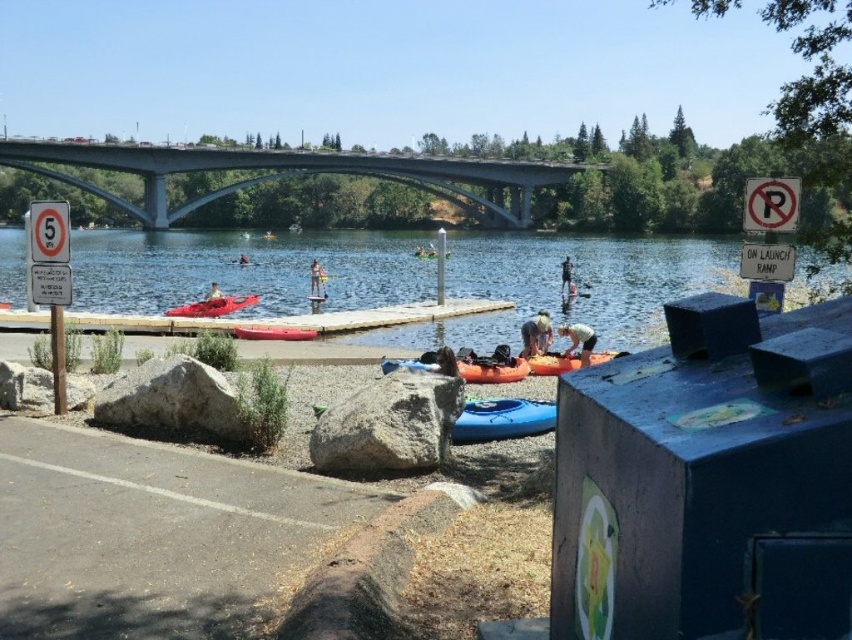
Question: Can you confirm if matte red kayak at center is positioned above light brown wooden paddleboard at center?

Choices:
 (A) yes
 (B) no

Answer: (B)

Question: Does concrete bridge at upper center appear on the left side of red plastic paddle at center?

Choices:
 (A) no
 (B) yes

Answer: (B)

Question: Which object is farther from the camera taking this photo?

Choices:
 (A) orange fabric person at center
 (B) matte red kayak at center
 (C) blue rubber kayak at center
 (D) clear water at center

Answer: (B)

Question: Which point is farther to the camera?

Choices:
 (A) light brown wooden paddleboard at center
 (B) orange fabric person at center
 (C) orange matte kayak at center
 (D) red kayak at center

Answer: (A)

Question: Among these points, which one is farthest from the camera?

Choices:
 (A) (285, 332)
 (B) (568, 260)
 (C) (219, 156)
 (D) (210, 307)

Answer: (C)

Question: Considering the relative positions of blue rubber kayak at center and light brown hair at lower center in the image provided, where is blue rubber kayak at center located with respect to light brown hair at lower center?

Choices:
 (A) above
 (B) below

Answer: (B)